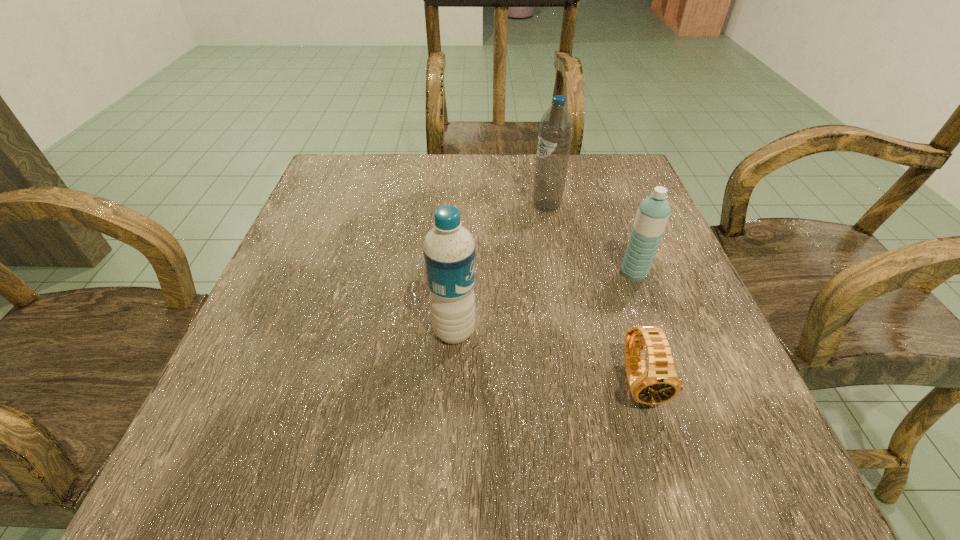
Image resolution: width=960 pixels, height=540 pixels. Identify the location of the farthest water bottle. (555, 132).

Find the location of a particular element. This screenshot has width=960, height=540. the second water bottle from left to right is located at coordinates (555, 132).

Image resolution: width=960 pixels, height=540 pixels. I want to click on the leftmost water bottle, so click(449, 250).

Where is `the third farthest object`? the third farthest object is located at coordinates (449, 250).

Locate an element on the screen. The height and width of the screenshot is (540, 960). the second farthest object is located at coordinates (653, 213).

Locate an element on the screen. This screenshot has width=960, height=540. the shortest water bottle is located at coordinates (653, 213).

Image resolution: width=960 pixels, height=540 pixels. What are the coordinates of `the shortest object` in the screenshot? It's located at (659, 383).

Where is `the nearest object`? the nearest object is located at coordinates (659, 383).

At what (x,y) coordinates should I click in order to perform the action: click on vacant space located on the left of the third object from right to left. Please return your answer as a coordinate pair (x, y). This screenshot has height=540, width=960. Looking at the image, I should click on (381, 205).

You are a GUI agent. You are given a task and a screenshot of the screen. Output one action in this format:
    pyautogui.click(x=<x>, y=<y>)
    Task: Click on the vacant space located on the label of the leftmost object
    
    Given the screenshot: What is the action you would take?
    pyautogui.click(x=624, y=331)